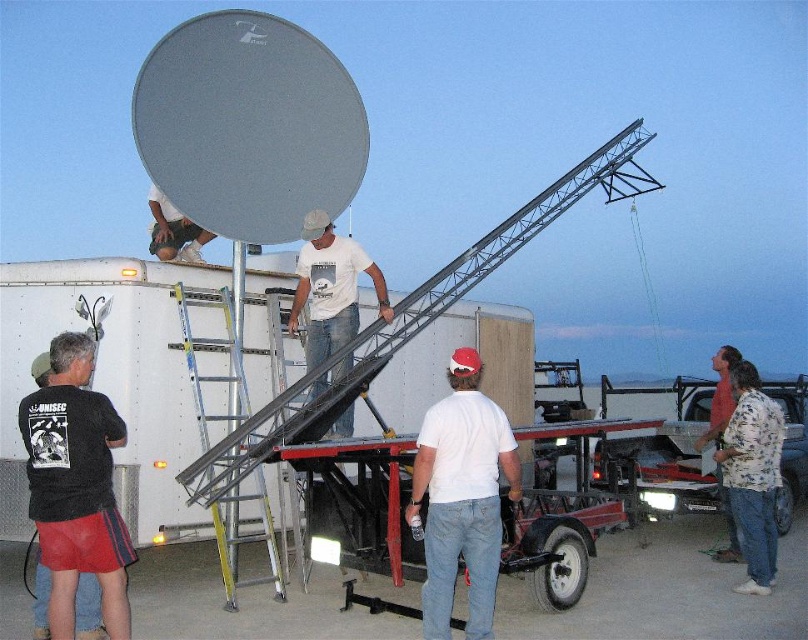
Who is taller, black cotton t-shirt at left or floral shirt at lower right?

With more height is black cotton t-shirt at left.

Find the location of a particular element. Image resolution: width=808 pixels, height=640 pixels. black cotton t-shirt at left is located at coordinates (76, 486).

Who is more forward, (34,483) or (762,506)?

Point (34,483) is more forward.

Find the location of a particular element. The image size is (808, 640). black cotton t-shirt at left is located at coordinates (76, 486).

Which is above, floral shirt at lower right or aluminum ladder at center?

Positioned higher is aluminum ladder at center.

How far apart are floral shirt at lower right and aluminum ladder at center?

floral shirt at lower right is 4.68 meters from aluminum ladder at center.

Which is behind, point (735, 497) or point (221, 557)?

Point (735, 497)

The height and width of the screenshot is (640, 808). I want to click on floral shirt at lower right, so click(752, 476).

Which of these two, silver metallic ladder at center or white t-shirt at center, stands shorter?

white t-shirt at center is shorter.

This screenshot has width=808, height=640. What do you see at coordinates (292, 522) in the screenshot? I see `silver metallic ladder at center` at bounding box center [292, 522].

Between point (284, 364) and point (730, 353), which one is positioned behind?

The point (730, 353) is behind.

Image resolution: width=808 pixels, height=640 pixels. What are the coordinates of `silver metallic ladder at center` in the screenshot? It's located at (292, 522).